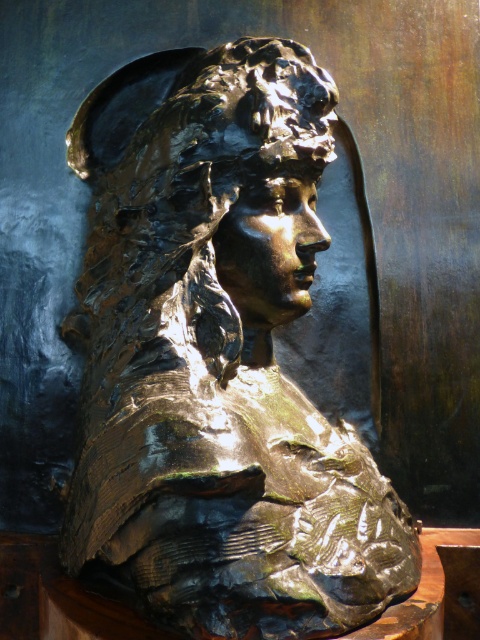
You are an art conservator examining the bronze bust sculpture. You notice two points on the sculpture labeled as point 1 at coordinates (283, 125) and point 2 at (267, 131). According to the spatial relationship between these points, which point is positioned further back on the sculpture?

Point 1 at coordinates (283, 125) is positioned further back on the sculpture compared to point 2 at (267, 131), as stated in the description.

You are an art student standing in front of the bronze bust at center and the bronze sculpture at center. Which one is closer to you?

The bronze bust at center is closer to you because it is in front of the bronze sculpture at center.